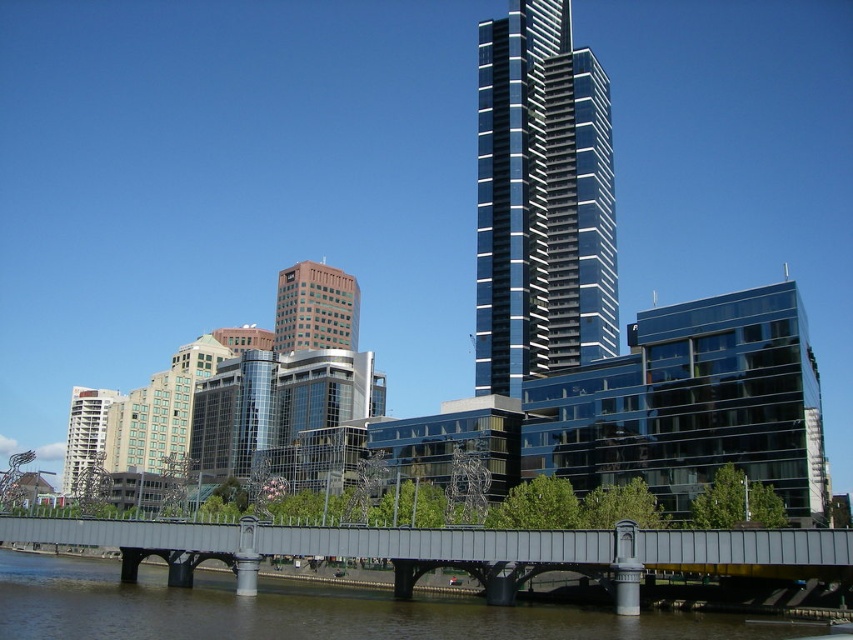
Is point (665, 536) positioned after point (329, 272)?

No.

Between metallic gray bridge at center and orange glass building at center, which one has more height?

Standing taller between the two is orange glass building at center.

Which is in front, point (535, 536) or point (289, 308)?

Point (535, 536)

Find the location of `metallic gray bridge at center`. metallic gray bridge at center is located at coordinates (453, 550).

Can you confirm if glossy glass skyscraper at center is smaller than metallic gray bridge at center?

No, glossy glass skyscraper at center is not smaller than metallic gray bridge at center.

Consider the image. Which is more to the left, glossy glass skyscraper at center or metallic gray bridge at center?

metallic gray bridge at center

Who is more forward, (x=512, y=346) or (x=715, y=564)?

Point (x=715, y=564)

This screenshot has height=640, width=853. In order to click on glossy glass skyscraper at center in this screenshot , I will do `click(541, 200)`.

Who is more distant from viewer, (521, 336) or (287, 337)?

Positioned behind is point (287, 337).

Who is more distant from viewer, [590,138] or [334,288]?

The point [334,288] is behind.

Locate an element on the screen. This screenshot has height=640, width=853. glossy glass skyscraper at center is located at coordinates 541,200.